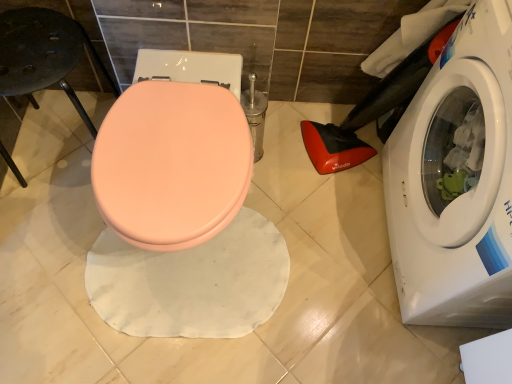
Question: Does black matte bar stool at left lie in front of matte peach toilet seat at center?

Choices:
 (A) no
 (B) yes

Answer: (A)

Question: Is black matte bar stool at left taller than matte peach toilet seat at center?

Choices:
 (A) no
 (B) yes

Answer: (A)

Question: From a real-world perspective, is black matte bar stool at left located higher than matte peach toilet seat at center?

Choices:
 (A) yes
 (B) no

Answer: (B)

Question: Considering the relative sizes of black matte bar stool at left and matte peach toilet seat at center in the image provided, is black matte bar stool at left shorter than matte peach toilet seat at center?

Choices:
 (A) no
 (B) yes

Answer: (B)

Question: Is black matte bar stool at left far away from matte peach toilet seat at center?

Choices:
 (A) no
 (B) yes

Answer: (A)

Question: From their relative heights in the image, would you say matte peach toilet seat at center is taller or shorter than white glossy washing machine at lower right?

Choices:
 (A) tall
 (B) short

Answer: (B)

Question: Do you think matte peach toilet seat at center is within white glossy washing machine at lower right, or outside of it?

Choices:
 (A) inside
 (B) outside

Answer: (B)

Question: In the image, is matte peach toilet seat at center positioned in front of or behind white glossy washing machine at lower right?

Choices:
 (A) behind
 (B) front

Answer: (A)

Question: From the image's perspective, is matte peach toilet seat at center above or below white glossy washing machine at lower right?

Choices:
 (A) above
 (B) below

Answer: (B)

Question: In terms of size, does black matte bar stool at left appear bigger or smaller than matte peach toilet seat at center?

Choices:
 (A) small
 (B) big

Answer: (A)

Question: Is black matte bar stool at left taller or shorter than matte peach toilet seat at center?

Choices:
 (A) short
 (B) tall

Answer: (A)

Question: Is point (51, 14) closer or farther from the camera than point (150, 163)?

Choices:
 (A) farther
 (B) closer

Answer: (A)

Question: Is black matte bar stool at left in front of or behind matte peach toilet seat at center in the image?

Choices:
 (A) front
 (B) behind

Answer: (B)

Question: Considering the positions of black matte bar stool at left and white glossy washing machine at lower right in the image, is black matte bar stool at left taller or shorter than white glossy washing machine at lower right?

Choices:
 (A) tall
 (B) short

Answer: (B)

Question: Would you say black matte bar stool at left is to the left or to the right of white glossy washing machine at lower right in the picture?

Choices:
 (A) right
 (B) left

Answer: (B)